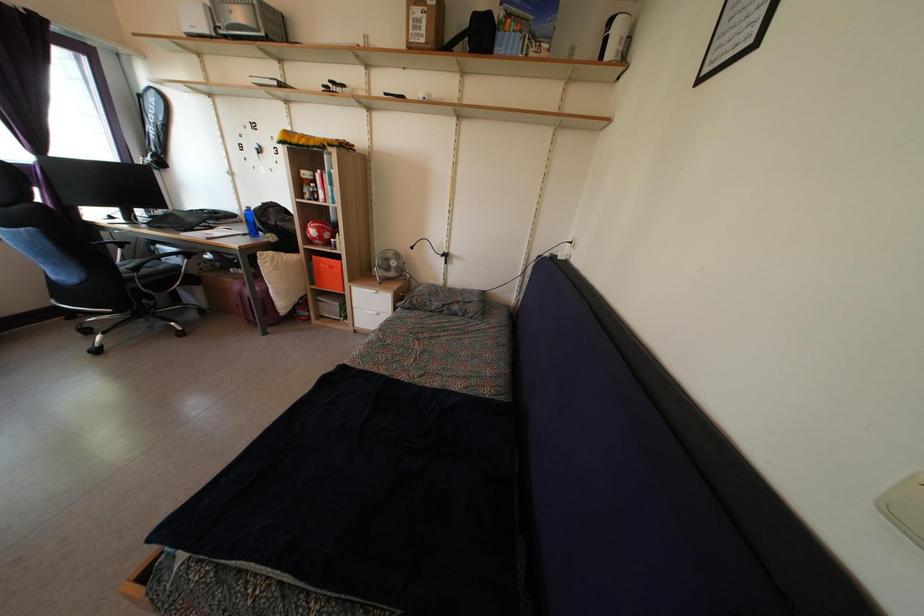
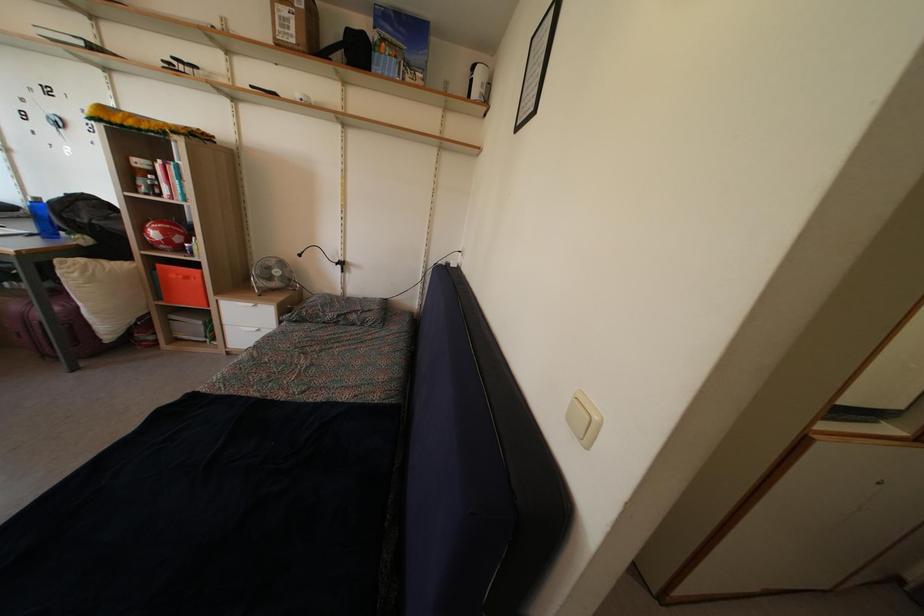
In the second image, find the point that corresponds to [334,276] in the first image.

(189, 286)